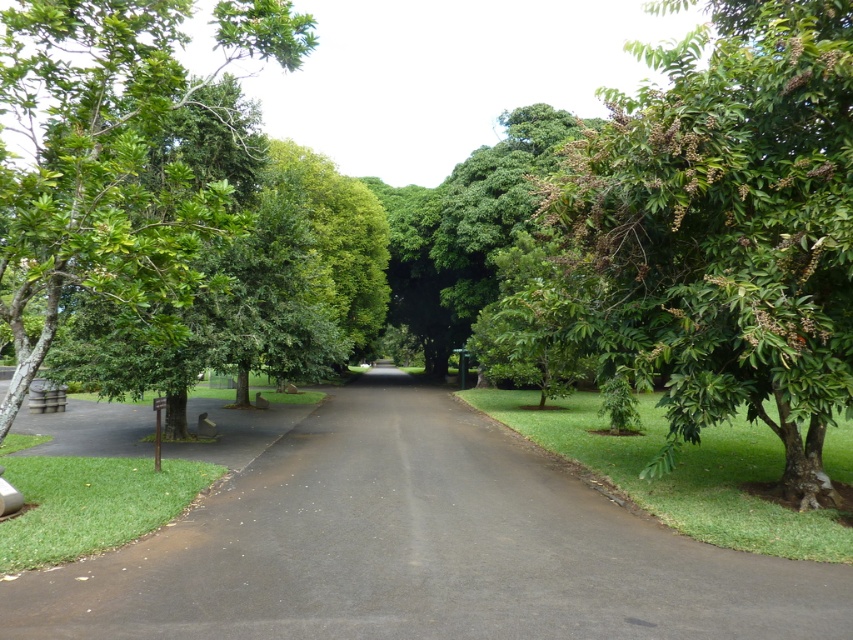
You are a delivery person with a 1.2 meter wide cart. You need to navigate through the black asphalt road at center and the green leafy tree at right. Can your cart pass through the space between them without touching either?

The black asphalt road at center might be wider than green leafy tree at right, so there is a possibility that the space between them is sufficient for the cart. However, since the exact width isn not specified, it is recommended to proceed cautiously to avoid collision.

Looking at this image, you are a pedestrian walking along the black asphalt road at center. You want to reach the green leafy tree at right. Which direction should you walk to get there?

The green leafy tree at right is located to the right of the black asphalt road at center, so you should walk to the right to reach it.

In the scene shown: You are standing at the starting point of the pathway and want to walk straight ahead. Based on the coordinates provided, will you stay on the black asphalt road at center as you move forward?

The black asphalt road at center is positioned at coordinates point [419,547], so yes, walking straight ahead will keep you on the black asphalt road at center.